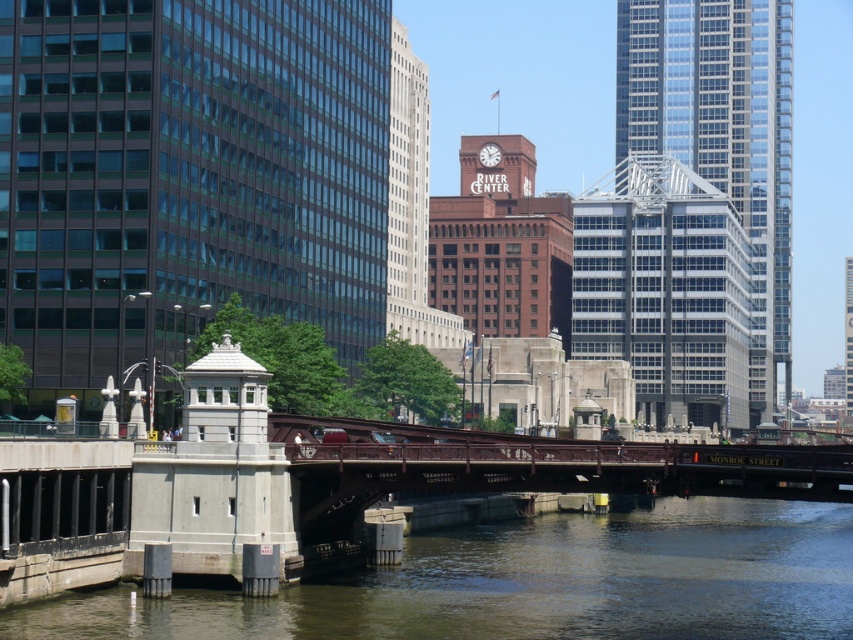
Question: Estimate the real-world distances between objects in this image. Which object is farther from the matte glass building at left?

Choices:
 (A) greenish concrete water at lower center
 (B) glassy reflective skyscraper at upper right
 (C) white glossy clock at center

Answer: (C)

Question: Does matte glass building at left have a smaller size compared to white glossy clock at center?

Choices:
 (A) yes
 (B) no

Answer: (B)

Question: Does glassy reflective skyscraper at upper right have a larger size compared to white glossy clock at center?

Choices:
 (A) yes
 (B) no

Answer: (A)

Question: Which object is closer to the camera taking this photo?

Choices:
 (A) glassy reflective skyscraper at upper right
 (B) matte glass building at left

Answer: (B)

Question: Which point appears farthest from the camera in this image?

Choices:
 (A) (115, 173)
 (B) (479, 152)
 (C) (788, 116)

Answer: (C)

Question: Can you confirm if greenish concrete water at lower center is smaller than white glossy clock at center?

Choices:
 (A) no
 (B) yes

Answer: (A)